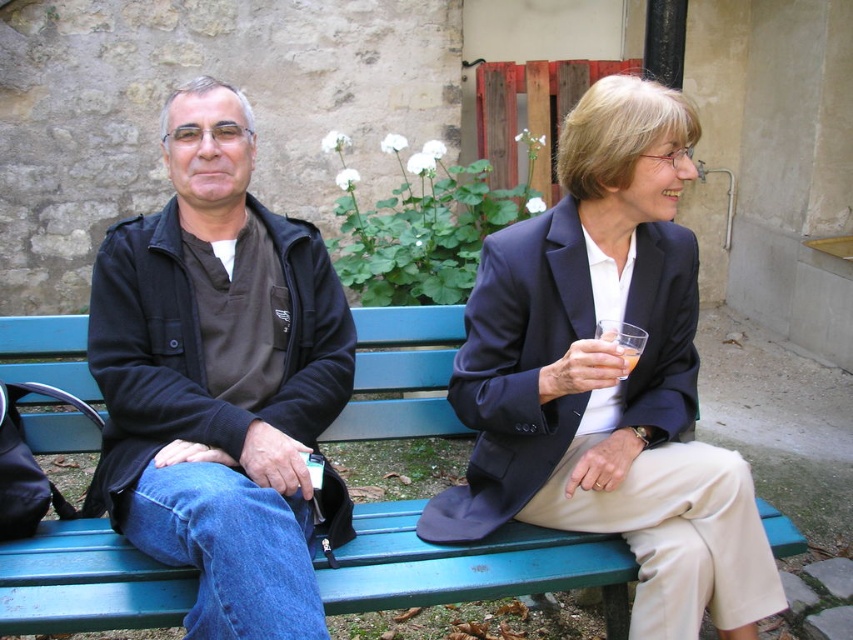
Question: Which point appears farthest from the camera in this image?

Choices:
 (A) (259, 404)
 (B) (10, 353)

Answer: (B)

Question: Does matte black blazer at center appear over dark blue jacket at left?

Choices:
 (A) yes
 (B) no

Answer: (A)

Question: Which of these objects is positioned farthest from the green painted wood bench at center?

Choices:
 (A) matte black blazer at center
 (B) dark blue jacket at left

Answer: (B)

Question: Which of the following is the farthest from the observer?

Choices:
 (A) matte black blazer at center
 (B) green painted wood bench at center

Answer: (B)

Question: Does matte black blazer at center appear under green painted wood bench at center?

Choices:
 (A) yes
 (B) no

Answer: (B)

Question: Is matte black blazer at center wider than green painted wood bench at center?

Choices:
 (A) yes
 (B) no

Answer: (A)